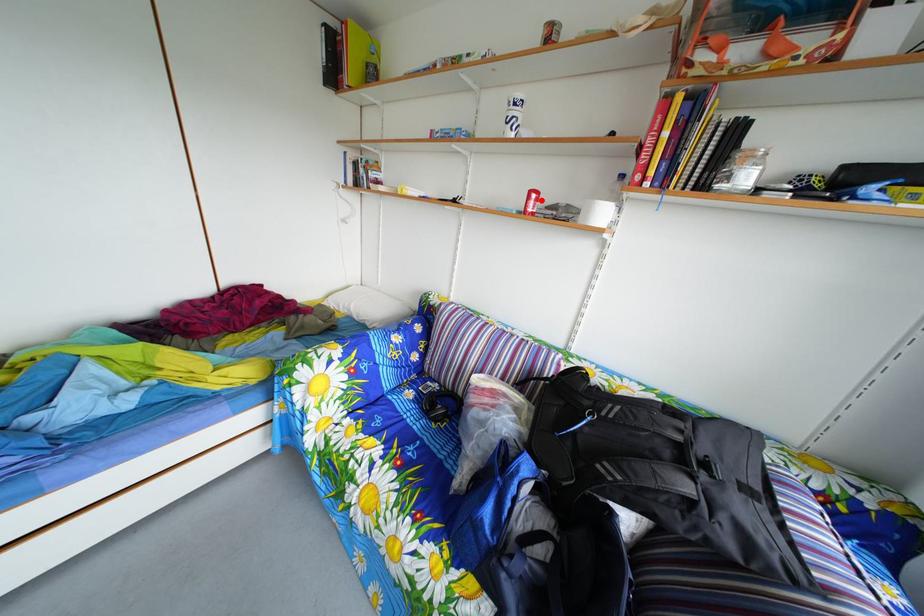
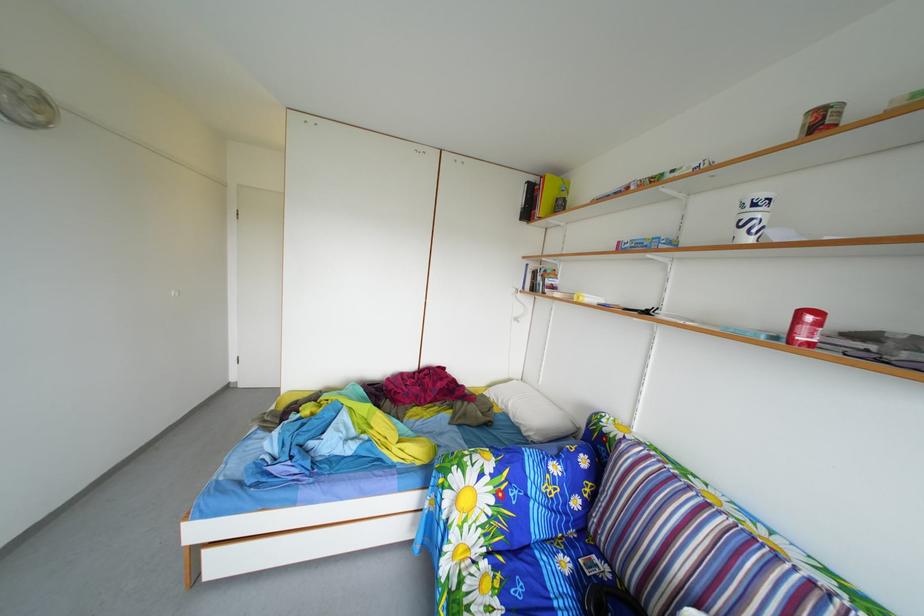
The point at the highlighted location is marked in the first image. Where is the corresponding point in the second image?

(811, 321)